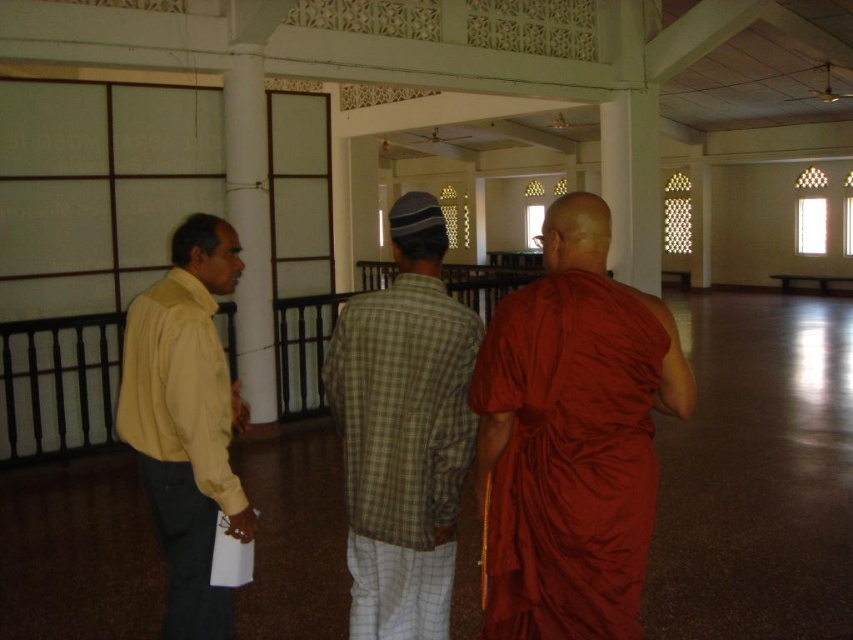
Question: Is green plaid shirt at center below yellow matte shirt at left?

Choices:
 (A) yes
 (B) no

Answer: (B)

Question: Is green plaid shirt at center closer to camera compared to yellow matte shirt at left?

Choices:
 (A) yes
 (B) no

Answer: (A)

Question: Estimate the real-world distances between objects in this image. Which object is farther from the matte orange robe at right?

Choices:
 (A) green plaid shirt at center
 (B) yellow matte shirt at left

Answer: (B)

Question: Which point appears closest to the camera in this image?

Choices:
 (A) (511, 310)
 (B) (194, 387)
 (C) (395, 468)

Answer: (A)

Question: Does matte orange robe at right appear over yellow matte shirt at left?

Choices:
 (A) yes
 (B) no

Answer: (A)

Question: Considering the real-world distances, which object is closest to the green plaid shirt at center?

Choices:
 (A) yellow matte shirt at left
 (B) matte orange robe at right

Answer: (B)